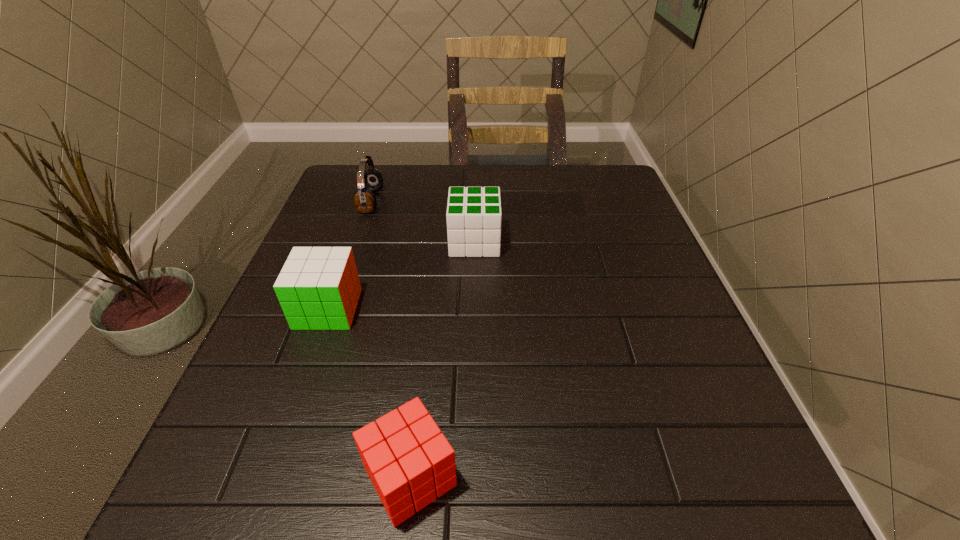
The image size is (960, 540). Find the location of `empty location between the headset and the nearest cube`. empty location between the headset and the nearest cube is located at coordinates click(391, 339).

I want to click on unoccupied area between the second farthest object and the farthest object, so click(422, 222).

Where is `object that ranks as the closest to the farthest cube`? object that ranks as the closest to the farthest cube is located at coordinates (369, 180).

Point out which object is positioned as the nearest to the shortest object. Please provide its 2D coordinates. Your answer should be formatted as a tuple, i.e. [(x, y)], where the tuple contains the x and y coordinates of a point satisfying the conditions above.

[(318, 288)]

Locate which cube ranks third in proximity to the headset. Please provide its 2D coordinates. Your answer should be formatted as a tuple, i.e. [(x, y)], where the tuple contains the x and y coordinates of a point satisfying the conditions above.

[(409, 461)]

Point out which cube is positioned as the second nearest to the headset. Please provide its 2D coordinates. Your answer should be formatted as a tuple, i.e. [(x, y)], where the tuple contains the x and y coordinates of a point satisfying the conditions above.

[(318, 288)]

At what (x,y) coordinates should I click in order to perform the action: click on free space that satisfies the following two spatial constraints: 1. on the ear cups of the headset; 2. on the front side of the leftmost cube. Please return your answer as a coordinate pair (x, y). The width and height of the screenshot is (960, 540). Looking at the image, I should click on (335, 309).

Find the location of a particular element. The height and width of the screenshot is (540, 960). vacant space that satisfies the following two spatial constraints: 1. on the red face of the farthest cube; 2. on the front side of the nearest object is located at coordinates (471, 476).

This screenshot has height=540, width=960. Identify the location of free space that satisfies the following two spatial constraints: 1. on the red face of the farthest cube; 2. on the front side of the nearest cube. (471, 476).

This screenshot has height=540, width=960. I want to click on vacant space that satisfies the following two spatial constraints: 1. on the red face of the third nearest object; 2. on the front side of the second farthest cube, so click(473, 309).